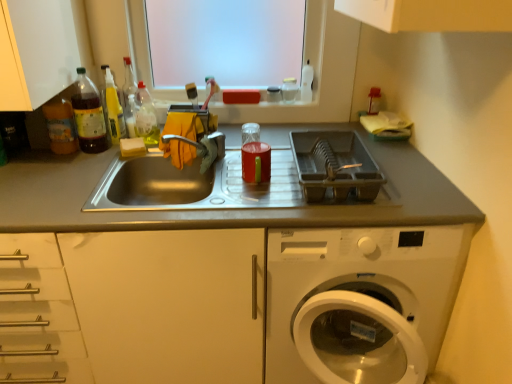
Find the location of a particular element. vacant space to the right of plastic dish rack at right is located at coordinates (405, 173).